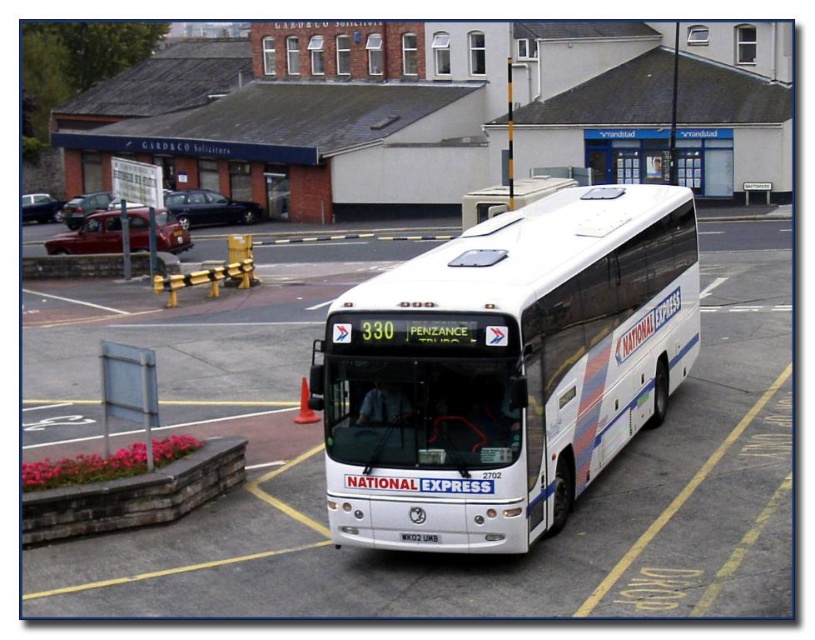
Question: Which of the following is the farthest from the observer?

Choices:
 (A) black plastic license plate at center
 (B) white glossy/decorative bus at center

Answer: (A)

Question: Can you confirm if white glossy/decorative bus at center is smaller than black plastic license plate at center?

Choices:
 (A) yes
 (B) no

Answer: (B)

Question: Is white glossy/decorative bus at center to the right of black plastic license plate at center from the viewer's perspective?

Choices:
 (A) yes
 (B) no

Answer: (B)

Question: Is white glossy/decorative bus at center thinner than black plastic license plate at center?

Choices:
 (A) yes
 (B) no

Answer: (B)

Question: Which point is farther to the camera?

Choices:
 (A) click(485, 269)
 (B) click(426, 541)

Answer: (A)